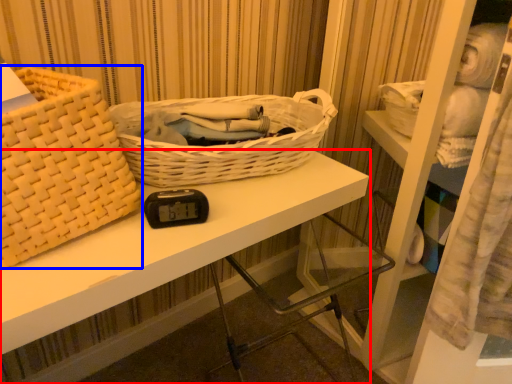
Question: Which point is further to the camera, desk (highlighted by a red box) or picnic basket (highlighted by a blue box)?

Choices:
 (A) desk
 (B) picnic basket

Answer: (A)